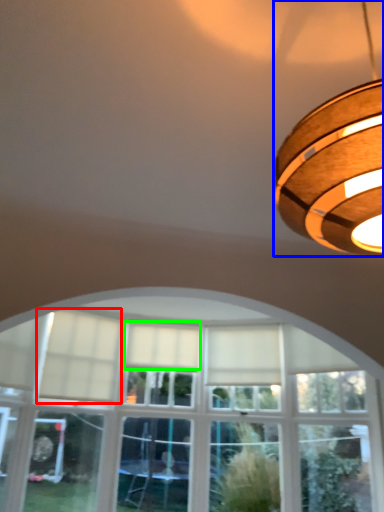
Question: Which object is the closest to the curtain (highlighted by a red box)? Choose among these: lamp (highlighted by a blue box) or curtain (highlighted by a green box).

Choices:
 (A) lamp
 (B) curtain

Answer: (B)